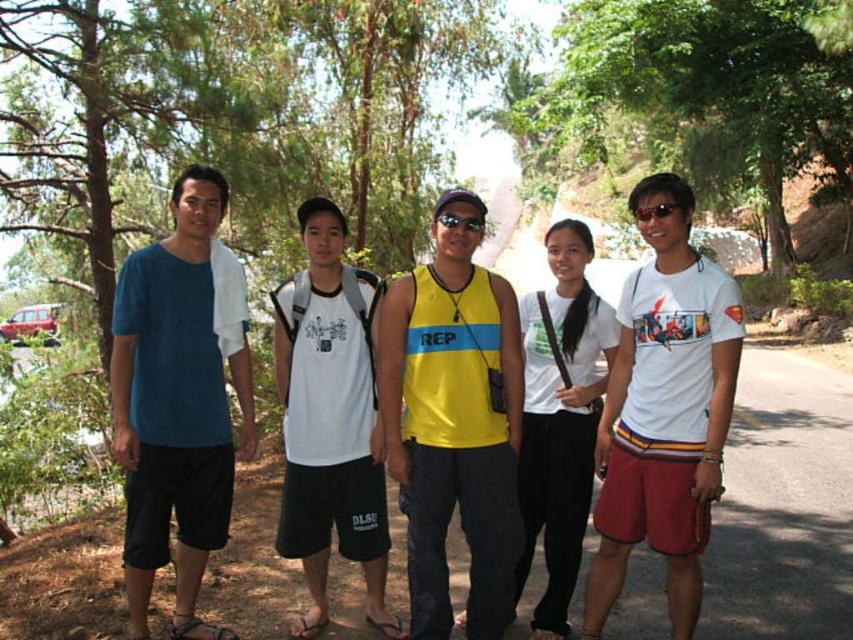
Is white matte tank top at center thinner than matte black sunglasses at center?

No, white matte tank top at center is not thinner than matte black sunglasses at center.

Is point (314, 612) more distant than point (459, 221)?

Yes, point (314, 612) is behind point (459, 221).

Locate an element on the screen. white matte tank top at center is located at coordinates (329, 419).

Between sunglasses at center and matte black sunglasses at center, which one has more height?

matte black sunglasses at center

Is point (643, 216) more distant than point (451, 227)?

No, it is not.

Between point (672, 209) and point (454, 212), which one is positioned behind?

Positioned behind is point (454, 212).

Locate an element on the screen. sunglasses at center is located at coordinates (654, 211).

What do you see at coordinates (664, 412) in the screenshot?
I see `white cotton t-shirt at right` at bounding box center [664, 412].

Can you confirm if white cotton t-shirt at right is bigger than sunglasses at center?

Yes, white cotton t-shirt at right is bigger than sunglasses at center.

Measure the distance between point (605, 605) and camera.

The distance of point (605, 605) from camera is 4.94 meters.

Find the location of a particular element. white cotton t-shirt at right is located at coordinates (664, 412).